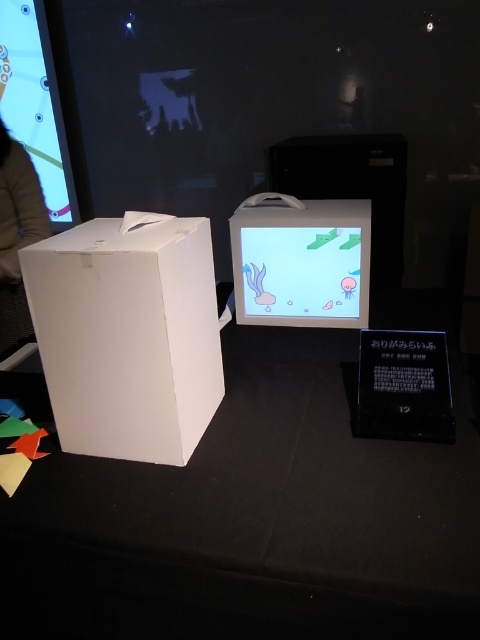
Question: Based on their relative distances, which object is nearer to the white matte cardboard box at left?

Choices:
 (A) matte plastic screen at center
 (B) brown leather jacket at left
 (C) black matte table at center

Answer: (C)

Question: Does black matte table at center appear on the right side of white matte cardboard box at left?

Choices:
 (A) no
 (B) yes

Answer: (B)

Question: Does white matte cardboard box at left appear under brown leather jacket at left?

Choices:
 (A) yes
 (B) no

Answer: (A)

Question: Is black matte table at center to the right of white matte cardboard box at left from the viewer's perspective?

Choices:
 (A) no
 (B) yes

Answer: (B)

Question: Estimate the real-world distances between objects in this image. Which object is farther from the black matte table at center?

Choices:
 (A) matte plastic screen at center
 (B) white matte cardboard box at left

Answer: (A)

Question: Which of the following is the farthest from the observer?

Choices:
 (A) brown leather jacket at left
 (B) matte plastic screen at center
 (C) white matte cardboard box at left

Answer: (A)